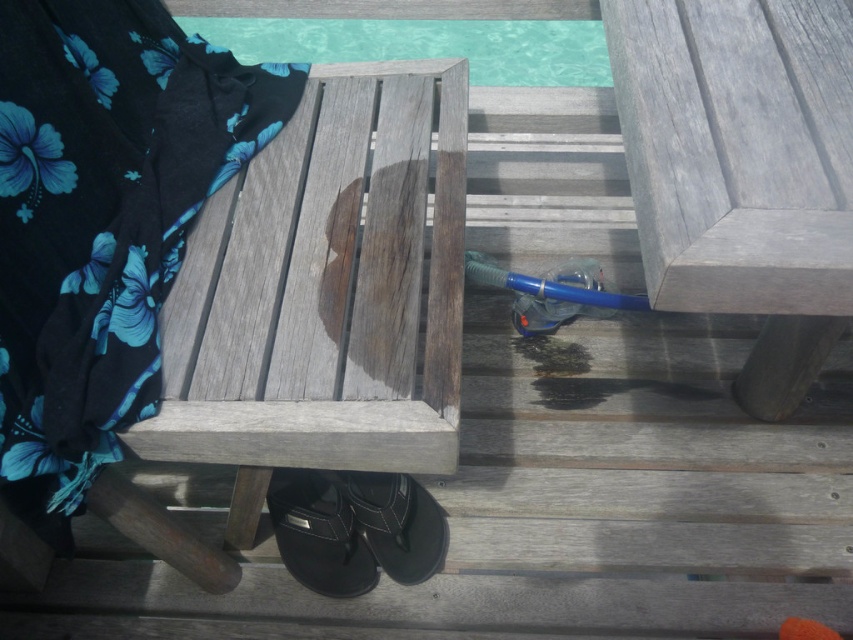
Who is more forward, (235, 17) or (314, 566)?

Point (314, 566) is more forward.

Is point (392, 35) positioned after point (306, 525)?

Yes, it is behind point (306, 525).

Who is more forward, (416, 28) or (323, 481)?

Point (323, 481)

This screenshot has width=853, height=640. I want to click on clear glass pool at upper center, so click(424, 44).

Is weathered wood bench at center wider than black leather sandal at lower center?

Correct, the width of weathered wood bench at center exceeds that of black leather sandal at lower center.

Does weathered wood bench at center appear on the left side of black leather sandal at lower center?

No, weathered wood bench at center is not to the left of black leather sandal at lower center.

I want to click on weathered wood bench at center, so click(323, 292).

Looking at this image, does weathered wood bench at center have a lesser width compared to clear glass pool at upper center?

Indeed, weathered wood bench at center has a lesser width compared to clear glass pool at upper center.

Can you confirm if weathered wood bench at center is shorter than clear glass pool at upper center?

In fact, weathered wood bench at center may be taller than clear glass pool at upper center.

Image resolution: width=853 pixels, height=640 pixels. What are the coordinates of `weathered wood bench at center` in the screenshot? It's located at (323, 292).